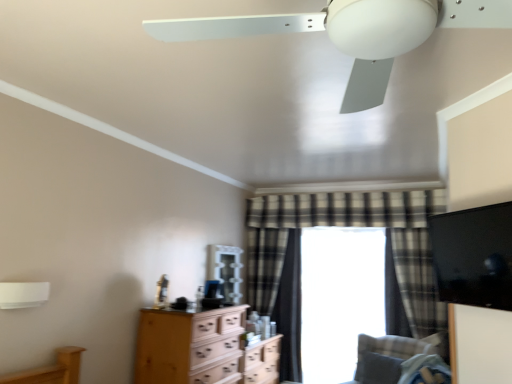
Locate an element on the screen. plaid fabric curtain at center, the 2th curtain viewed from the left is located at coordinates (290, 310).

This screenshot has width=512, height=384. What do you see at coordinates (290, 310) in the screenshot?
I see `plaid fabric curtain at center, the second curtain from the right` at bounding box center [290, 310].

What do you see at coordinates (265, 267) in the screenshot?
I see `plaid fabric curtain at center, placed as the 1th curtain when sorted from left to right` at bounding box center [265, 267].

You are a GUI agent. You are given a task and a screenshot of the screen. Output one action in this format:
    pyautogui.click(x=<x>, y=<y>)
    Task: Click on the gray fabric pillow at lower right
    The height and width of the screenshot is (384, 512).
    Given the screenshot: What is the action you would take?
    pyautogui.click(x=378, y=369)

Looking at this image, measure the distance between gray fabric pillow at lower right and camera.

gray fabric pillow at lower right is 3.53 meters away from camera.

The image size is (512, 384). What do you see at coordinates (398, 361) in the screenshot?
I see `velvet gray swivel chair at lower right` at bounding box center [398, 361].

This screenshot has width=512, height=384. Identify the location of light brown wood chest of drawers at center. (202, 349).

Measure the distance between point (309, 353) and camera.

They are 4.57 meters apart.

Measure the distance between point (22, 302) and camera.

The depth of point (22, 302) is 2.19 meters.

Locate an element on the screen. white matte lamp at upper left is located at coordinates (23, 294).

What are the coordinates of `plaid fabric curtain at center, the 2th curtain viewed from the left` in the screenshot? It's located at (290, 310).

Which is correct: gray fabric pillow at lower right is inside plaid fabric curtain at center, the second curtain from the right, or outside of it?

gray fabric pillow at lower right cannot be found inside plaid fabric curtain at center, the second curtain from the right.

Is gray fabric pillow at lower right positioned far away from plaid fabric curtain at center, the 2th curtain viewed from the left?

Yes.

From a real-world perspective, is gray fabric pillow at lower right on top of plaid fabric curtain at center, the 2th curtain viewed from the left?

No, from a real-world perspective, gray fabric pillow at lower right is not over plaid fabric curtain at center, the 2th curtain viewed from the left

From the image's perspective, which one is positioned higher, gray fabric pillow at lower right or plaid fabric curtain at center, the second curtain from the right?

plaid fabric curtain at center, the second curtain from the right, is shown above in the image.

In the image, is plaid fabric curtain at center, positioned as the first curtain in right-to-left order, positioned in front of or behind plaid fabric curtain at center, placed as the 1th curtain when sorted from left to right?

Clearly, plaid fabric curtain at center, positioned as the first curtain in right-to-left order, is in front of plaid fabric curtain at center, placed as the 1th curtain when sorted from left to right.

Is plaid fabric curtain at center, positioned as the first curtain in right-to-left order, oriented away from plaid fabric curtain at center, placed as the 1th curtain when sorted from left to right?

plaid fabric curtain at center, positioned as the first curtain in right-to-left order, is not turned away from plaid fabric curtain at center, placed as the 1th curtain when sorted from left to right.

Can you confirm if plaid fabric curtain at center, positioned as the first curtain in right-to-left order, is taller than plaid fabric curtain at center, the 3th curtain from the right?

No, plaid fabric curtain at center, positioned as the first curtain in right-to-left order, is not taller than plaid fabric curtain at center, the 3th curtain from the right.

Which point is more forward, (408, 273) or (250, 267)?

The point (408, 273) is more forward.

Relative to plaid fabric curtain at center, the 3th curtain from the right, is velvet gray swivel chair at lower right in front or behind?

velvet gray swivel chair at lower right is in front of plaid fabric curtain at center, the 3th curtain from the right.

Locate an element on the screen. swivel chair in front of the plaid fabric curtain at center, the 3th curtain from the right is located at coordinates (398, 361).

Is plaid fabric curtain at center, the 3th curtain from the right, inside velvet gray swivel chair at lower right?

No, velvet gray swivel chair at lower right does not contain plaid fabric curtain at center, the 3th curtain from the right.

Does velvet gray swivel chair at lower right appear on the right side of plaid fabric curtain at center, the 3th curtain from the right?

Yes.

Is transparent glass window at center to the left of gray fabric pillow at lower right from the viewer's perspective?

Yes.

Is transparent glass window at center far from gray fabric pillow at lower right?

transparent glass window at center is near gray fabric pillow at lower right, not far away.

Do you think transparent glass window at center is within gray fabric pillow at lower right, or outside of it?

transparent glass window at center lies outside gray fabric pillow at lower right.

Which object is thinner, transparent glass window at center or gray fabric pillow at lower right?

With smaller width is transparent glass window at center.

Which is nearer, (215, 382) or (23, 296)?

Clearly, point (215, 382) is more distant from the camera than point (23, 296).

Find the location of a particular element. The height and width of the screenshot is (384, 512). lamp above the light brown wood chest of drawers at center (from the image's perspective) is located at coordinates (23, 294).

Would you say light brown wood chest of drawers at center is inside or outside white matte lamp at upper left?

light brown wood chest of drawers at center is not inside white matte lamp at upper left, it's outside.

Is light brown wood chest of drawers at center located outside plaid fabric curtain at center, positioned as the first curtain in right-to-left order?

That's correct, light brown wood chest of drawers at center is outside of plaid fabric curtain at center, positioned as the first curtain in right-to-left order.

Are light brown wood chest of drawers at center and plaid fabric curtain at center, marked as the 3th curtain in a left-to-right arrangement, far apart?

Indeed, light brown wood chest of drawers at center is not near plaid fabric curtain at center, marked as the 3th curtain in a left-to-right arrangement.

In the scene shown: Can you confirm if light brown wood chest of drawers at center is wider than plaid fabric curtain at center, positioned as the first curtain in right-to-left order?

Indeed, light brown wood chest of drawers at center has a greater width compared to plaid fabric curtain at center, positioned as the first curtain in right-to-left order.

Is plaid fabric curtain at center, the 2th curtain viewed from the left, facing towards light brown wood chest of drawers at center?

Yes, plaid fabric curtain at center, the 2th curtain viewed from the left, faces towards light brown wood chest of drawers at center.

Is plaid fabric curtain at center, the 2th curtain viewed from the left, touching light brown wood chest of drawers at center?

No, plaid fabric curtain at center, the 2th curtain viewed from the left, is not next to light brown wood chest of drawers at center.

From a real-world perspective, who is located higher, plaid fabric curtain at center, the 2th curtain viewed from the left, or light brown wood chest of drawers at center?

In real-world perspective, plaid fabric curtain at center, the 2th curtain viewed from the left, is above.

Can you confirm if plaid fabric curtain at center, the second curtain from the right, is wider than light brown wood chest of drawers at center?

No, plaid fabric curtain at center, the second curtain from the right, is not wider than light brown wood chest of drawers at center.

Locate an element on the screen. The image size is (512, 384). pillow located underneath the plaid fabric curtain at center, the second curtain from the right (from a real-world perspective) is located at coordinates pyautogui.click(x=378, y=369).

Where is `the 1st curtain behind when counting from the plaid fabric curtain at center, positioned as the first curtain in right-to-left order`? The width and height of the screenshot is (512, 384). the 1st curtain behind when counting from the plaid fabric curtain at center, positioned as the first curtain in right-to-left order is located at coordinates (265, 267).

From the image, which object appears to be farther from transparent glass window at center, plaid fabric curtain at center, the 2th curtain viewed from the left, or plaid fabric curtain at center, marked as the 3th curtain in a left-to-right arrangement?

The object further to transparent glass window at center is plaid fabric curtain at center, marked as the 3th curtain in a left-to-right arrangement.

From the image, which object appears to be farther from gray fabric pillow at lower right, light brown wood chest of drawers at center or plaid fabric curtain at center, the second curtain from the right?

Among the two, light brown wood chest of drawers at center is located further to gray fabric pillow at lower right.

Which object lies nearer to the anchor point gray fabric pillow at lower right, plaid fabric curtain at center, positioned as the first curtain in right-to-left order, or velvet gray swivel chair at lower right?

velvet gray swivel chair at lower right is positioned closer to the anchor gray fabric pillow at lower right.

Considering their positions, is light brown wood chest of drawers at center positioned closer to gray fabric pillow at lower right than white matte ceiling fan at upper center?

Based on the image, light brown wood chest of drawers at center appears to be nearer to gray fabric pillow at lower right.

Looking at the image, which one is located closer to plaid fabric curtain at center, the second curtain from the right, plaid fabric curtain at center, marked as the 3th curtain in a left-to-right arrangement, or velvet gray swivel chair at lower right?

velvet gray swivel chair at lower right lies closer to plaid fabric curtain at center, the second curtain from the right, than the other object.

Based on their spatial positions, is gray fabric pillow at lower right or white matte lamp at upper left closer to plaid fabric curtain at center, the 2th curtain viewed from the left?

gray fabric pillow at lower right is positioned closer to the anchor plaid fabric curtain at center, the 2th curtain viewed from the left.

Based on their spatial positions, is plaid fabric curtain at center, placed as the 1th curtain when sorted from left to right, or white matte ceiling fan at upper center closer to plaid fabric curtain at center, marked as the 3th curtain in a left-to-right arrangement?

plaid fabric curtain at center, placed as the 1th curtain when sorted from left to right.

Looking at the image, which one is located closer to velvet gray swivel chair at lower right, transparent glass window at center or plaid fabric curtain at center, the second curtain from the right?

Based on the image, transparent glass window at center appears to be nearer to velvet gray swivel chair at lower right.

Find the location of a particular element. The height and width of the screenshot is (384, 512). pillow between white matte lamp at upper left and plaid fabric curtain at center, the 2th curtain viewed from the left, in the front-back direction is located at coordinates (378, 369).

Where is `pillow located between velvet gray swivel chair at lower right and transparent glass window at center in the depth direction`? This screenshot has width=512, height=384. pillow located between velvet gray swivel chair at lower right and transparent glass window at center in the depth direction is located at coordinates (378, 369).

Find the location of a particular element. This screenshot has height=384, width=512. swivel chair between white matte ceiling fan at upper center and transparent glass window at center in the front-back direction is located at coordinates (398, 361).

Locate an element on the screen. chest of drawers between white matte lamp at upper left and velvet gray swivel chair at lower right is located at coordinates coord(202,349).